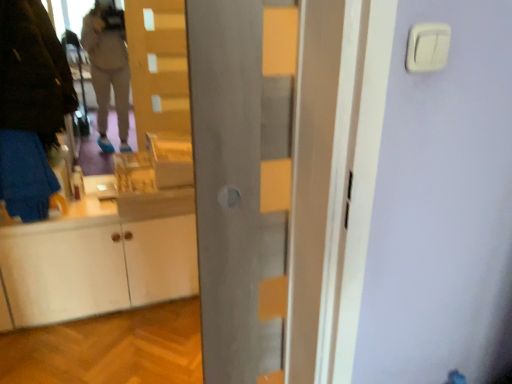
The width and height of the screenshot is (512, 384). What are the coordinates of `metallic gray door at center` in the screenshot? It's located at (227, 179).

What do you see at coordinates (426, 47) in the screenshot?
I see `white plastic light switch at upper right` at bounding box center [426, 47].

Locate an element on the screen. The width and height of the screenshot is (512, 384). metallic gray door at center is located at coordinates (227, 179).

Does dark brown leather jacket at left turn towards metallic gray door at center?

No, dark brown leather jacket at left is not aimed at metallic gray door at center.

Is dark brown leather jacket at left at the left side of metallic gray door at center?

Indeed, dark brown leather jacket at left is positioned on the left side of metallic gray door at center.

Can you confirm if dark brown leather jacket at left is taller than metallic gray door at center?

Incorrect, the height of dark brown leather jacket at left is not larger of that of metallic gray door at center.

Based on the photo, is dark brown leather jacket at left wider or thinner than metallic gray door at center?

In the image, dark brown leather jacket at left appears to be wider than metallic gray door at center.

From the image's perspective, is metallic gray door at center over dark brown leather jacket at left?

Incorrect, from the image's perspective, metallic gray door at center is lower than dark brown leather jacket at left.

From a real-world perspective, is metallic gray door at center under dark brown leather jacket at left?

Yes, from a real-world perspective, metallic gray door at center is beneath dark brown leather jacket at left.

Is metallic gray door at center wider or thinner than dark brown leather jacket at left?

Considering their sizes, metallic gray door at center looks slimmer than dark brown leather jacket at left.

Does metallic gray door at center appear on the right side of dark brown leather jacket at left?

Indeed, metallic gray door at center is positioned on the right side of dark brown leather jacket at left.

Between dark brown leather jacket at left and white plastic light switch at upper right, which one appears on the left side from the viewer's perspective?

From the viewer's perspective, dark brown leather jacket at left appears more on the left side.

From the picture: Which is more distant, (9, 65) or (410, 41)?

The point (9, 65) is farther from the camera.

Does dark brown leather jacket at left have a lesser width compared to white plastic light switch at upper right?

No.

Consider the image. Is dark brown leather jacket at left directly adjacent to white plastic light switch at upper right?

dark brown leather jacket at left and white plastic light switch at upper right are not in contact.

Does white plastic light switch at upper right turn towards dark brown leather jacket at left?

No.

Can you tell me how much white plastic light switch at upper right and dark brown leather jacket at left differ in facing direction?

The angle between the facing direction of white plastic light switch at upper right and the facing direction of dark brown leather jacket at left is 0.0729 degrees.

Is point (449, 44) closer to camera compared to point (10, 76)?

Yes.

Considering the sizes of white plastic light switch at upper right and dark brown leather jacket at left in the image, is white plastic light switch at upper right bigger or smaller than dark brown leather jacket at left?

white plastic light switch at upper right is smaller than dark brown leather jacket at left.

Is metallic gray door at center to the left of white plastic light switch at upper right from the viewer's perspective?

Correct, you'll find metallic gray door at center to the left of white plastic light switch at upper right.

Which object is thinner, metallic gray door at center or white plastic light switch at upper right?

white plastic light switch at upper right.

Is metallic gray door at center outside of white plastic light switch at upper right?

That's correct, metallic gray door at center is outside of white plastic light switch at upper right.

Can you confirm if white plastic light switch at upper right is positioned to the left of metallic gray door at center?

No, white plastic light switch at upper right is not to the left of metallic gray door at center.

Considering the relative sizes of white plastic light switch at upper right and metallic gray door at center in the image provided, is white plastic light switch at upper right thinner than metallic gray door at center?

Yes.

From the image's perspective, relative to metallic gray door at center, is white plastic light switch at upper right above or below?

white plastic light switch at upper right is above metallic gray door at center.

Is white plastic light switch at upper right turned away from metallic gray door at center?

No, metallic gray door at center is not at the back of white plastic light switch at upper right.

Where is `person to the left of metallic gray door at center`? person to the left of metallic gray door at center is located at coordinates (30, 106).

Identify the location of door located below the dark brown leather jacket at left (from the image's perspective). (227, 179).

Based on their spatial positions, is white plastic light switch at upper right or metallic gray door at center further from dark brown leather jacket at left?

white plastic light switch at upper right lies further to dark brown leather jacket at left than the other object.

Based on their spatial positions, is dark brown leather jacket at left or metallic gray door at center further from white plastic light switch at upper right?

dark brown leather jacket at left is further to white plastic light switch at upper right.

Considering their positions, is dark brown leather jacket at left positioned closer to metallic gray door at center than white plastic light switch at upper right?

Based on the image, white plastic light switch at upper right appears to be nearer to metallic gray door at center.

Based on their spatial positions, is metallic gray door at center or white plastic light switch at upper right further from dark brown leather jacket at left?

white plastic light switch at upper right lies further to dark brown leather jacket at left than the other object.

Estimate the real-world distances between objects in this image. Which object is closer to white plastic light switch at upper right, metallic gray door at center or dark brown leather jacket at left?

metallic gray door at center is positioned closer to the anchor white plastic light switch at upper right.

Which object lies further to the anchor point metallic gray door at center, white plastic light switch at upper right or dark brown leather jacket at left?

Based on the image, dark brown leather jacket at left appears to be further to metallic gray door at center.

Where is `door between dark brown leather jacket at left and white plastic light switch at upper right from left to right`? door between dark brown leather jacket at left and white plastic light switch at upper right from left to right is located at coordinates (227, 179).